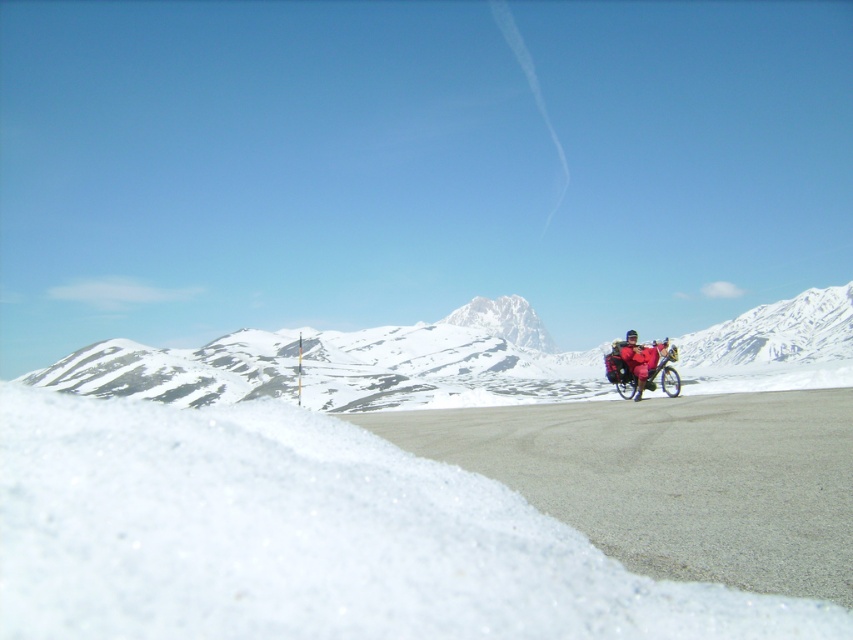
You are a cyclist planning to ride along the road in the winter scene. You see the snowy white mountain at right and the shiny blue bicycle at right. Which object is further to the right?

The snowy white mountain at right is positioned on the right side of the shiny blue bicycle at right, so the snowy white mountain at right is further to the right.